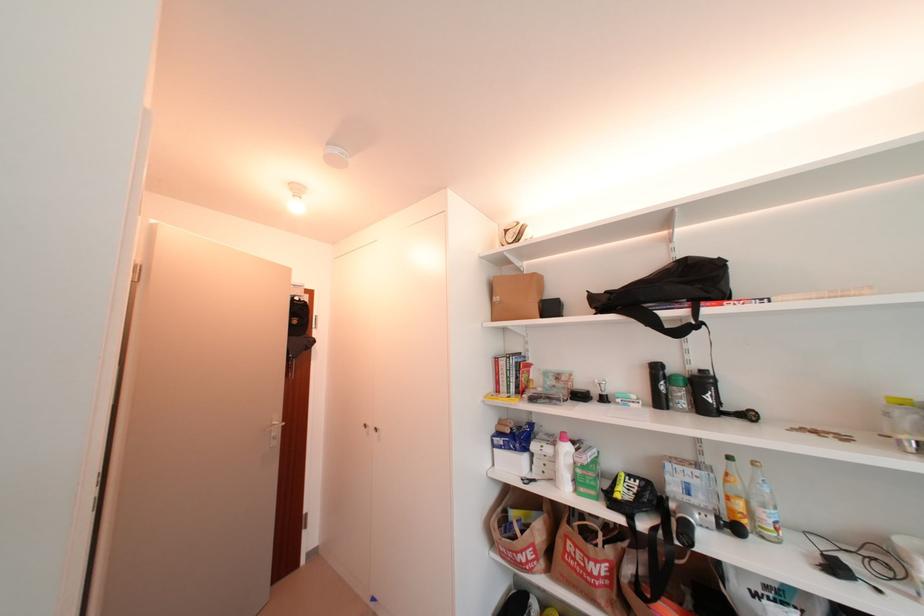
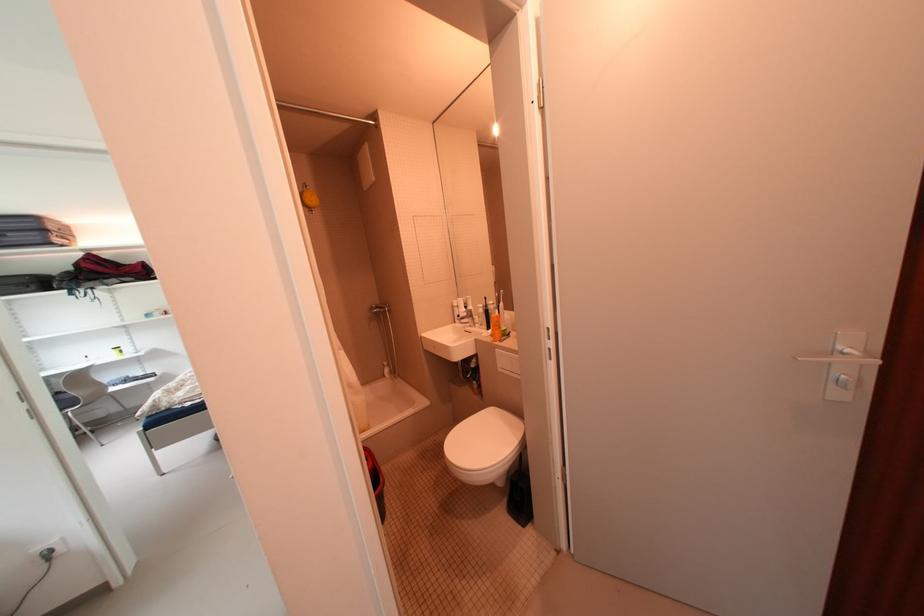
In the second image, find the point that corresponds to [284,424] in the first image.

(857, 352)